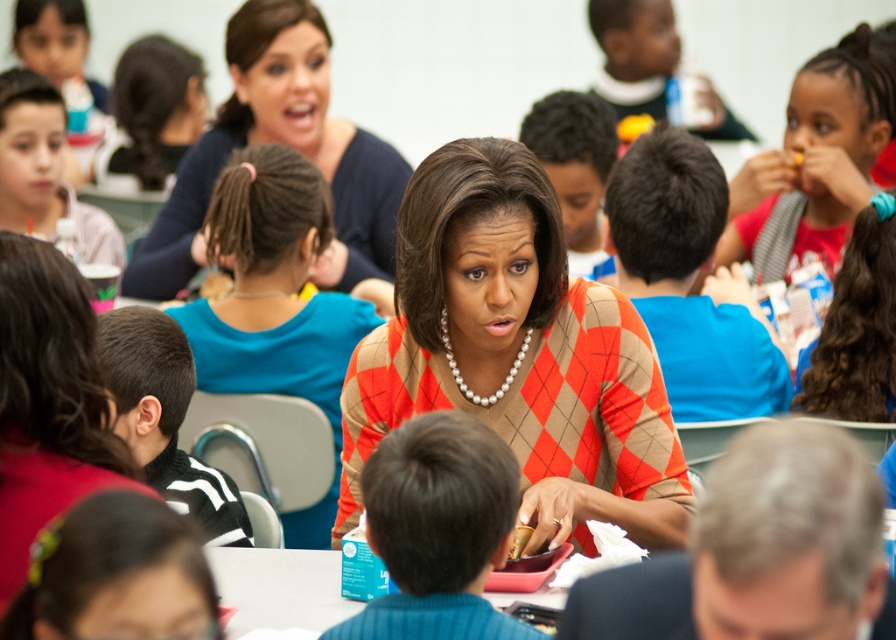
You are a photographer trying to capture a closeup of the black fleece jacket at left without including the matte blue sweater at upper left in the frame. Given their sizes, is this possible?

The matte blue sweater at upper left is larger in size than the black fleece jacket at left, so it might block the view. However, since the black fleece jacket at left is smaller, you can adjust your angle to focus solely on it by moving closer or shifting the camera position to exclude the larger sweater.

You are a photographer trying to capture a group photo of the people around the blue plastic table at center. The matte blue sweater at upper left is partially blocking your view. Can you estimate if the sweater is wider than the table, making it harder to frame the shot?

The matte blue sweater at upper left might be wider than blue plastic table at center, so it could potentially block the view more than the table and make it harder to frame the shot.